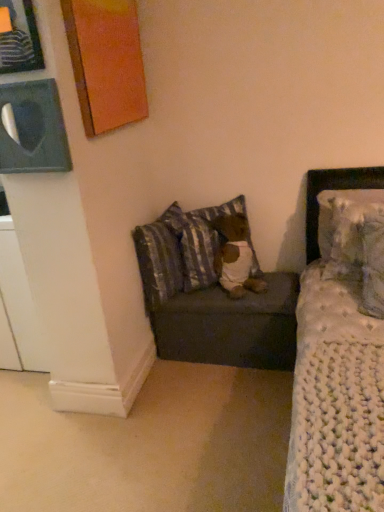
Question: From a real-world perspective, does striped fabric pillow at lower center, which ranks as the third pillow in right-to-left order, sit lower than white knitted pillow at upper right, marked as the third pillow in a left-to-right arrangement?

Choices:
 (A) no
 (B) yes

Answer: (B)

Question: Does striped fabric pillow at lower center, the 2th pillow positioned from the left, have a smaller size compared to white knitted pillow at upper right, marked as the third pillow in a left-to-right arrangement?

Choices:
 (A) yes
 (B) no

Answer: (A)

Question: Considering the relative sizes of striped fabric pillow at lower center, which ranks as the third pillow in right-to-left order, and white knitted pillow at upper right, marked as the third pillow in a left-to-right arrangement, in the image provided, is striped fabric pillow at lower center, which ranks as the third pillow in right-to-left order, wider than white knitted pillow at upper right, marked as the third pillow in a left-to-right arrangement,?

Choices:
 (A) no
 (B) yes

Answer: (A)

Question: From the image's perspective, would you say striped fabric pillow at lower center, the 2th pillow positioned from the left, is positioned over white knitted pillow at upper right, placed as the second pillow when sorted from right to left?

Choices:
 (A) yes
 (B) no

Answer: (A)

Question: Is striped fabric pillow at lower center, the 2th pillow positioned from the left, oriented away from white knitted pillow at upper right, marked as the third pillow in a left-to-right arrangement?

Choices:
 (A) yes
 (B) no

Answer: (B)

Question: From the image's perspective, relative to striped fabric pillow at lower left, which is counted as the first pillow, starting from the left, is brown plush bear at center above or below?

Choices:
 (A) below
 (B) above

Answer: (A)

Question: Is brown plush bear at center wider or thinner than striped fabric pillow at lower left, which is counted as the first pillow, starting from the left?

Choices:
 (A) wide
 (B) thin

Answer: (A)

Question: Considering the positions of brown plush bear at center and striped fabric pillow at lower left, which is counted as the first pillow, starting from the left, in the image, is brown plush bear at center taller or shorter than striped fabric pillow at lower left, which is counted as the first pillow, starting from the left,?

Choices:
 (A) short
 (B) tall

Answer: (A)

Question: Is brown plush bear at center spatially inside striped fabric pillow at lower left, the fourth pillow from the right, or outside of it?

Choices:
 (A) inside
 (B) outside

Answer: (B)

Question: From a real-world perspective, relative to orange painted wood picture frame at upper left, arranged as the second picture frame when viewed from the front, is matte black picture frame at upper left, which is the first picture frame from back to front, vertically above or below?

Choices:
 (A) below
 (B) above

Answer: (A)

Question: From the image's perspective, is matte black picture frame at upper left, placed as the 3th picture frame when sorted from front to back, positioned above or below orange painted wood picture frame at upper left, positioned as the second picture frame in back-to-front order?

Choices:
 (A) below
 (B) above

Answer: (A)

Question: Is matte black picture frame at upper left, placed as the 3th picture frame when sorted from front to back, in front of or behind orange painted wood picture frame at upper left, arranged as the second picture frame when viewed from the front, in the image?

Choices:
 (A) front
 (B) behind

Answer: (B)

Question: In terms of width, does matte black picture frame at upper left, which is the first picture frame from back to front, look wider or thinner when compared to orange painted wood picture frame at upper left, arranged as the second picture frame when viewed from the front?

Choices:
 (A) thin
 (B) wide

Answer: (A)

Question: Relative to brown plush bear at center, is striped fabric pillow at lower center, the 2th pillow positioned from the left, in front or behind?

Choices:
 (A) behind
 (B) front

Answer: (A)

Question: Considering the positions of striped fabric pillow at lower center, which ranks as the third pillow in right-to-left order, and brown plush bear at center in the image, is striped fabric pillow at lower center, which ranks as the third pillow in right-to-left order, taller or shorter than brown plush bear at center?

Choices:
 (A) short
 (B) tall

Answer: (B)